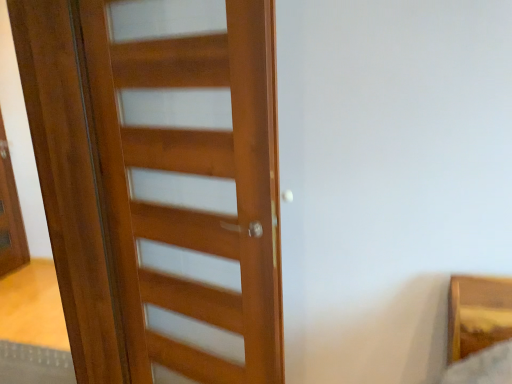
Question: Is the surface of matte wooden screen door at left in direct contact with wooden door at left?

Choices:
 (A) yes
 (B) no

Answer: (B)

Question: From the image's perspective, is matte wooden screen door at left on wooden door at left?

Choices:
 (A) no
 (B) yes

Answer: (B)

Question: Is matte wooden screen door at left not within wooden door at left?

Choices:
 (A) no
 (B) yes

Answer: (B)

Question: Is matte wooden screen door at left facing away from wooden door at left?

Choices:
 (A) no
 (B) yes

Answer: (A)

Question: Can you confirm if matte wooden screen door at left is bigger than wooden door at left?

Choices:
 (A) yes
 (B) no

Answer: (B)

Question: Considering the relative sizes of matte wooden screen door at left and wooden door at left in the image provided, is matte wooden screen door at left shorter than wooden door at left?

Choices:
 (A) yes
 (B) no

Answer: (A)

Question: Does wooden door at left lie behind matte wooden screen door at left?

Choices:
 (A) yes
 (B) no

Answer: (B)

Question: From a real-world perspective, is wooden door at left over matte wooden screen door at left?

Choices:
 (A) yes
 (B) no

Answer: (A)

Question: Can you confirm if wooden door at left is shorter than matte wooden screen door at left?

Choices:
 (A) yes
 (B) no

Answer: (B)

Question: From the image's perspective, is wooden door at left below matte wooden screen door at left?

Choices:
 (A) yes
 (B) no

Answer: (A)

Question: Is wooden door at left surrounding matte wooden screen door at left?

Choices:
 (A) yes
 (B) no

Answer: (B)

Question: Would you say wooden door at left is outside matte wooden screen door at left?

Choices:
 (A) no
 (B) yes

Answer: (B)

Question: From the image's perspective, is matte wooden screen door at left above or below wooden door at left?

Choices:
 (A) above
 (B) below

Answer: (A)